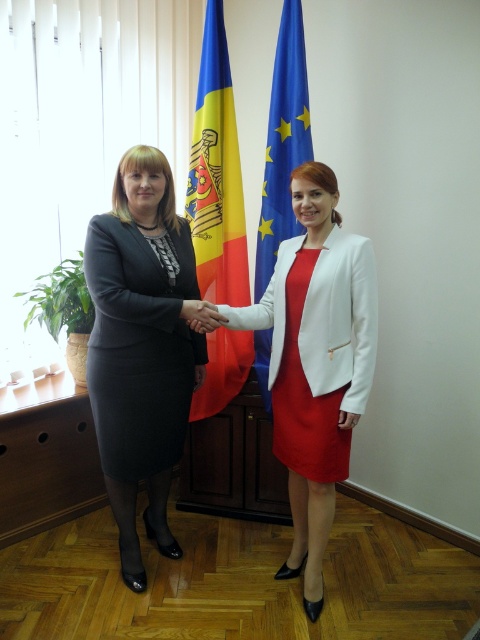
Question: Which object is closer to the camera taking this photo?

Choices:
 (A) matte black skirt at left
 (B) blue fabric flag at center
 (C) polyester flag at center
 (D) white matte hand at center

Answer: (A)

Question: Which of the following is the closest to the observer?

Choices:
 (A) click(342, 422)
 (B) click(297, 132)
 (C) click(156, 230)

Answer: (A)

Question: Does matte black skirt at left have a greater width compared to black matte hand at center?

Choices:
 (A) yes
 (B) no

Answer: (A)

Question: Which object is positioned farthest from the white matte blazer at center?

Choices:
 (A) matte black hand at center
 (B) blue fabric flag at center
 (C) matte black skirt at left

Answer: (B)

Question: Is the position of matte black hand at center more distant than that of white matte hand at center?

Choices:
 (A) no
 (B) yes

Answer: (B)

Question: Observing the image, what is the correct spatial positioning of blue fabric flag at center in reference to black matte hand at center?

Choices:
 (A) above
 (B) below

Answer: (A)